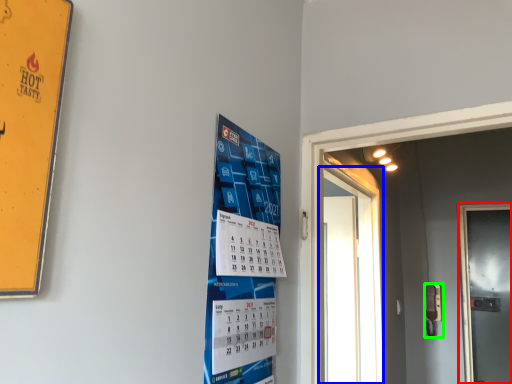
Question: Considering the real-world distances, which object is closest to door (highlighted by a red box)? door (highlighted by a blue box) or door handle (highlighted by a green box).

Choices:
 (A) door
 (B) door handle

Answer: (B)